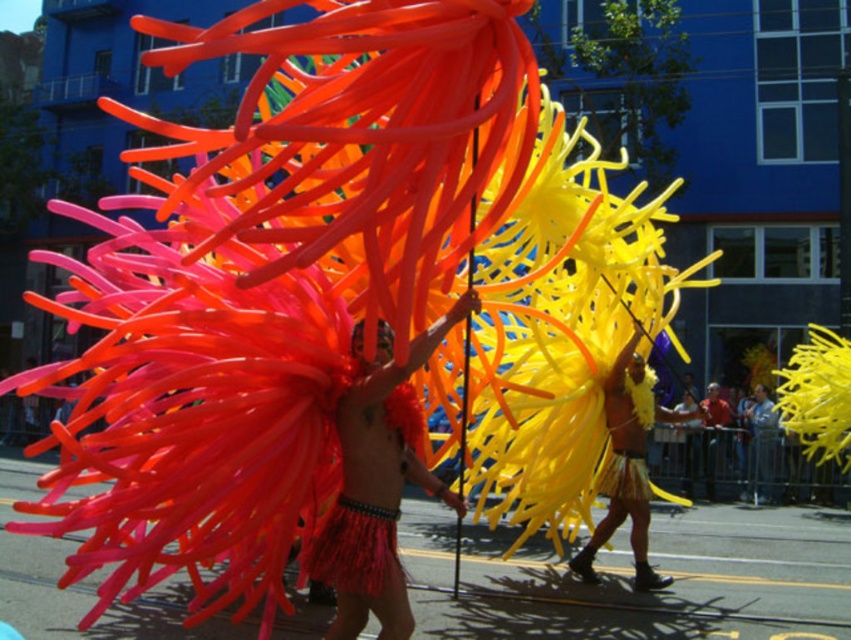
Does shiny red feathers at center appear on the left side of reddish-brown leather jacket at center?

Yes, shiny red feathers at center is to the left of reddish-brown leather jacket at center.

Between shiny red feathers at center and reddish-brown leather jacket at center, which one is positioned higher?

shiny red feathers at center

What do you see at coordinates (375, 486) in the screenshot? I see `shiny red feathers at center` at bounding box center [375, 486].

Identify the location of shiny red feathers at center. (375, 486).

Who is taller, yellow matte/yellowish fabric at center or reddish-brown leather jacket at center?

Standing taller between the two is reddish-brown leather jacket at center.

Is yellow matte/yellowish fabric at center positioned before reddish-brown leather jacket at center?

Yes, yellow matte/yellowish fabric at center is in front of reddish-brown leather jacket at center.

Where is `yellow matte/yellowish fabric at center`? The image size is (851, 640). yellow matte/yellowish fabric at center is located at coordinates (627, 464).

The width and height of the screenshot is (851, 640). What do you see at coordinates (375, 486) in the screenshot?
I see `shiny red feathers at center` at bounding box center [375, 486].

Which is in front, point (404, 440) or point (638, 472)?

Positioned in front is point (404, 440).

Find the location of `shiny red feathers at center`. shiny red feathers at center is located at coordinates (375, 486).